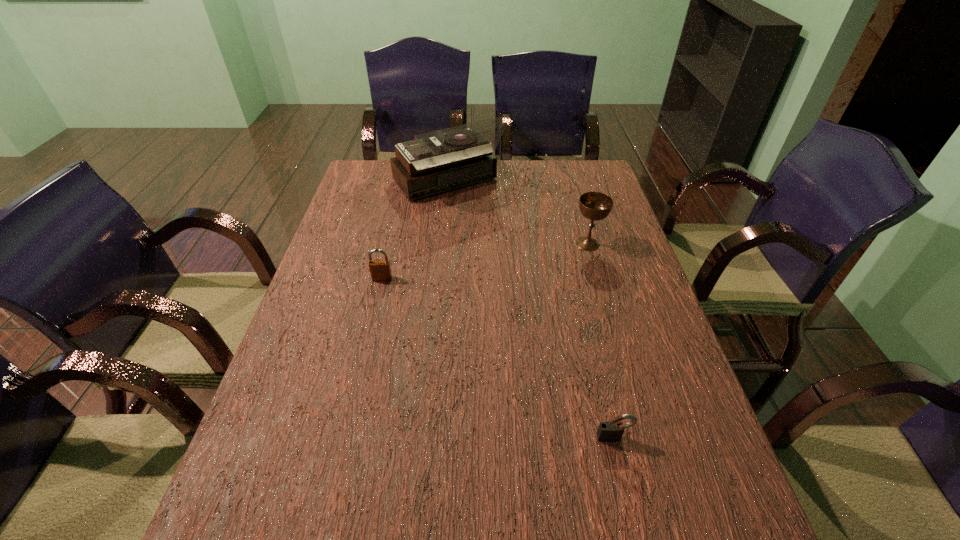
Identify the location of record player. click(438, 161).

The height and width of the screenshot is (540, 960). I want to click on the tallest object, so click(x=438, y=161).

The height and width of the screenshot is (540, 960). What are the coordinates of `the third nearest object` in the screenshot? It's located at (595, 206).

Where is `chalice`? This screenshot has width=960, height=540. chalice is located at coordinates (595, 206).

Where is `the farther padlock`? The image size is (960, 540). the farther padlock is located at coordinates (380, 270).

The height and width of the screenshot is (540, 960). What are the coordinates of `the second shortest object` in the screenshot? It's located at (380, 270).

Identify the location of the nearest object. (611, 431).

Identify the location of the nearer padlock. The image size is (960, 540). (611, 431).

This screenshot has width=960, height=540. I want to click on free space located 0.130m on the front of the farthest object, so click(x=442, y=239).

The width and height of the screenshot is (960, 540). I want to click on vacant space situated 0.140m on the front of the third nearest object, so click(x=600, y=287).